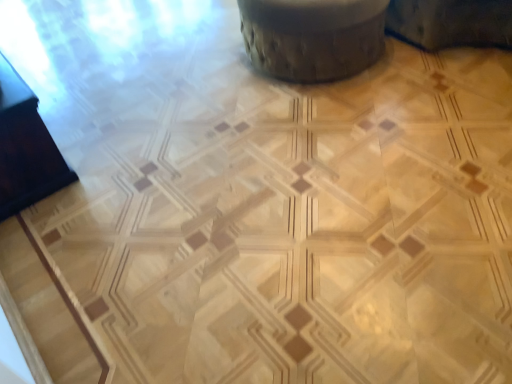
Find the location of a particular element. The height and width of the screenshot is (384, 512). black glossy drawer at left is located at coordinates coord(25,148).

Describe the element at coordinates (25, 148) in the screenshot. The width and height of the screenshot is (512, 384). I see `black glossy drawer at left` at that location.

Identify the location of wooden textured swivel chair at upper center. (313, 37).

Image resolution: width=512 pixels, height=384 pixels. What do you see at coordinates (313, 37) in the screenshot? I see `wooden textured swivel chair at upper center` at bounding box center [313, 37].

This screenshot has height=384, width=512. Find the location of `black glossy drawer at left`. black glossy drawer at left is located at coordinates (25, 148).

Does black glossy drawer at left appear on the left side of wooden textured swivel chair at upper center?

Yes.

Which object is more forward, black glossy drawer at left or wooden textured swivel chair at upper center?

black glossy drawer at left is in front.

Which is nearer, (29, 100) or (328, 21)?

Clearly, point (29, 100) is closer to the camera than point (328, 21).

From the image's perspective, is black glossy drawer at left below wooden textured swivel chair at upper center?

Yes.

From a real-world perspective, which object rests below the other?

black glossy drawer at left is physically lower.

Does black glossy drawer at left have a lesser width compared to wooden textured swivel chair at upper center?

Yes.

In terms of height, does black glossy drawer at left look taller or shorter compared to wooden textured swivel chair at upper center?

black glossy drawer at left is shorter than wooden textured swivel chair at upper center.

Is black glossy drawer at left bigger than wooden textured swivel chair at upper center?

No, black glossy drawer at left is not bigger than wooden textured swivel chair at upper center.

Based on the photo, would you say wooden textured swivel chair at upper center is part of black glossy drawer at left's contents?

No, wooden textured swivel chair at upper center is not a part of black glossy drawer at left.

Is black glossy drawer at left far away from wooden textured swivel chair at upper center?

black glossy drawer at left is far away from wooden textured swivel chair at upper center.

Is wooden textured swivel chair at upper center at the back of black glossy drawer at left?

No, wooden textured swivel chair at upper center is not at the back of black glossy drawer at left.

How different are the orientations of black glossy drawer at left and wooden textured swivel chair at upper center in degrees?

The facing directions of black glossy drawer at left and wooden textured swivel chair at upper center are 89.7 degrees apart.

Measure the distance from black glossy drawer at left to wooden textured swivel chair at upper center.

black glossy drawer at left is 4.23 feet from wooden textured swivel chair at upper center.

In order to click on swivel chair behind the black glossy drawer at left in this screenshot , I will do `click(313, 37)`.

Based on their positions, is wooden textured swivel chair at upper center located to the left or right of black glossy drawer at left?

wooden textured swivel chair at upper center is to the right of black glossy drawer at left.

Which object is closer to the camera taking this photo, wooden textured swivel chair at upper center or black glossy drawer at left?

black glossy drawer at left is more forward.

Is point (264, 43) farther from camera compared to point (8, 158)?

Yes, point (264, 43) is farther from viewer.

From the image's perspective, which one is positioned higher, wooden textured swivel chair at upper center or black glossy drawer at left?

wooden textured swivel chair at upper center, from the image's perspective.

From a real-world perspective, which object stands above the other?

wooden textured swivel chair at upper center.

Which object is wider, wooden textured swivel chair at upper center or black glossy drawer at left?

wooden textured swivel chair at upper center is wider.

Who is taller, wooden textured swivel chair at upper center or black glossy drawer at left?

With more height is wooden textured swivel chair at upper center.

Based on their sizes in the image, would you say wooden textured swivel chair at upper center is bigger or smaller than black glossy drawer at left?

Considering their sizes, wooden textured swivel chair at upper center takes up more space than black glossy drawer at left.

Is wooden textured swivel chair at upper center located outside black glossy drawer at left?

wooden textured swivel chair at upper center lies outside black glossy drawer at left's area.

Based on the photo, is wooden textured swivel chair at upper center beside black glossy drawer at left?

No, wooden textured swivel chair at upper center is not next to black glossy drawer at left.

Is wooden textured swivel chair at upper center positioned with its back to black glossy drawer at left?

No, wooden textured swivel chair at upper center is not facing the opposite direction of black glossy drawer at left.

Can you tell me how much wooden textured swivel chair at upper center and black glossy drawer at left differ in facing direction?

89.7 degrees.

I want to click on swivel chair behind the black glossy drawer at left, so click(313, 37).

Where is `furniture lying in front of the wooden textured swivel chair at upper center`? The image size is (512, 384). furniture lying in front of the wooden textured swivel chair at upper center is located at coordinates (25, 148).

Where is `swivel chair located above the black glossy drawer at left (from a real-world perspective)`? This screenshot has height=384, width=512. swivel chair located above the black glossy drawer at left (from a real-world perspective) is located at coordinates (313, 37).